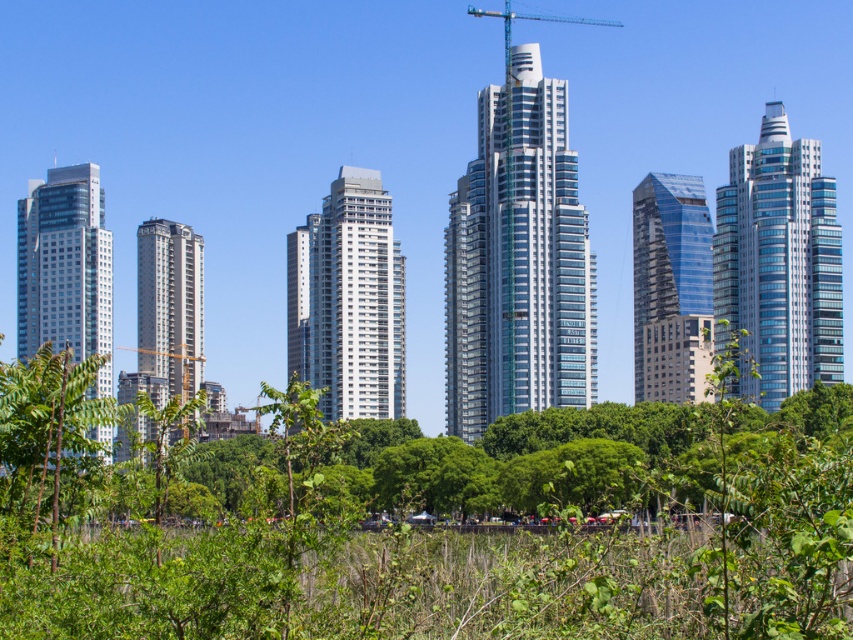
Question: Which object appears farthest from the camera in this image?

Choices:
 (A) transparent glass skyscraper at center-right
 (B) green leafy tree at left
 (C) glassy blue skyscraper at right

Answer: (A)

Question: Is glassy blue skyscraper at right bigger than blue metallic crane at upper center?

Choices:
 (A) yes
 (B) no

Answer: (B)

Question: Can you confirm if glassy steel skyscraper at center is positioned to the right of transparent glass skyscraper at center-right?

Choices:
 (A) yes
 (B) no

Answer: (B)

Question: Which of these objects is positioned closest to the green leafy tree at center?

Choices:
 (A) blue metallic crane at upper center
 (B) transparent glass skyscraper at center-right

Answer: (B)

Question: Which point is farther from the camera taking this photo?

Choices:
 (A) (531, 346)
 (B) (103, 269)
 (C) (200, 380)
 (D) (381, 376)

Answer: (C)

Question: Considering the relative positions of glassy silver skyscraper at left and blue metallic crane at upper center in the image provided, where is glassy silver skyscraper at left located with respect to blue metallic crane at upper center?

Choices:
 (A) left
 (B) right

Answer: (A)